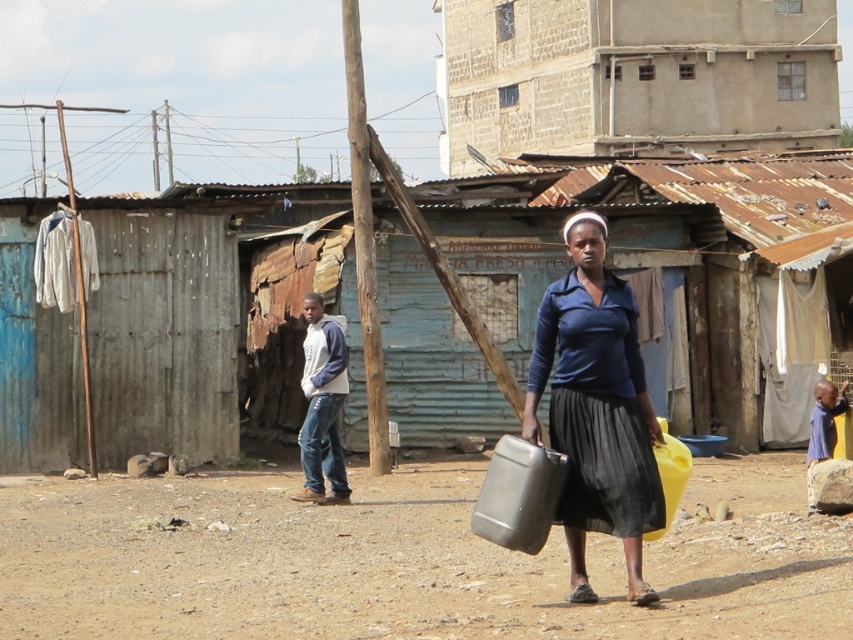
You are a delivery person trying to deliver a package to the brown stucco building at upper center. You notice a matte black water container at center in your path. Can you walk around it without going too far out of your way?

The brown stucco building at upper center is taller than the matte black water container at center, so yes, you can walk around the matte black water container at center since it is shorter and less obstructive.

Based on the scene described, which object is larger in size between the rusty corrugated metal hut at center and the brown stucco building at upper center?

The brown stucco building at upper center is larger than the rusty corrugated metal hut at center.

Based on the scene description, which object is taller between the rusty corrugated metal hut at center and the brown stucco building at upper center?

The brown stucco building at upper center is taller than the rusty corrugated metal hut at center.